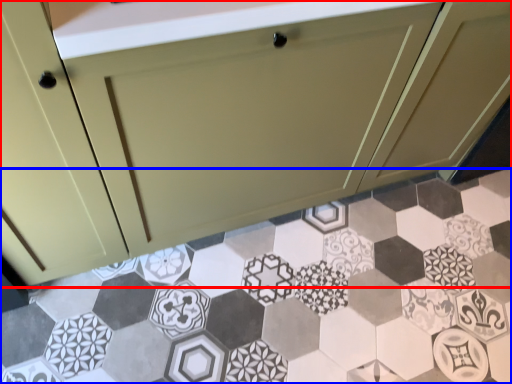
Question: Which object is closer to the camera taking this photo, cabinetry (highlighted by a red box) or porcelain (highlighted by a blue box)?

Choices:
 (A) cabinetry
 (B) porcelain

Answer: (A)